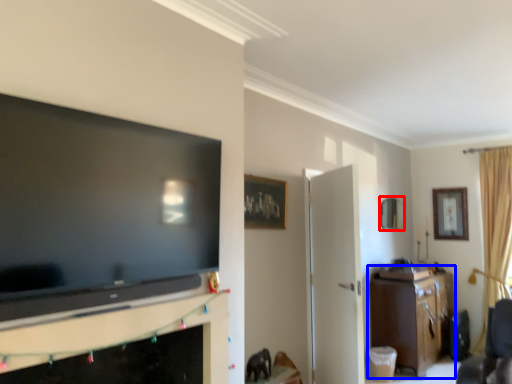
Question: Which point is closer to the camera, picture frame (highlighted by a red box) or cabinetry (highlighted by a blue box)?

Choices:
 (A) picture frame
 (B) cabinetry

Answer: (B)